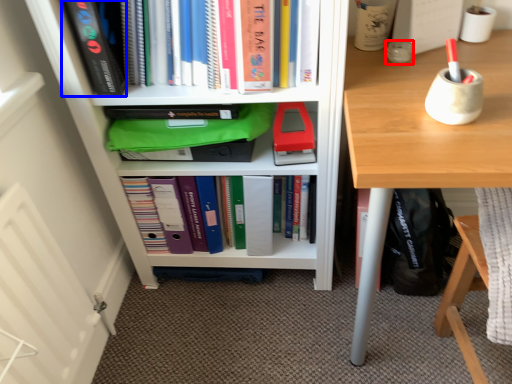
Question: Which object appears closest to the camera in this image, stationery (highlighted by a red box) or paperback book (highlighted by a blue box)?

Choices:
 (A) stationery
 (B) paperback book

Answer: (B)